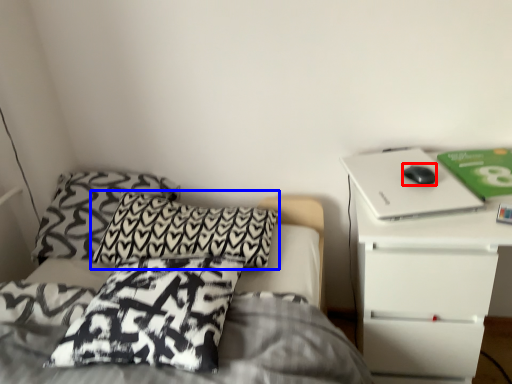
Question: Which point is closer to the camera, mouse (highlighted by a red box) or pillow (highlighted by a blue box)?

Choices:
 (A) mouse
 (B) pillow

Answer: (A)